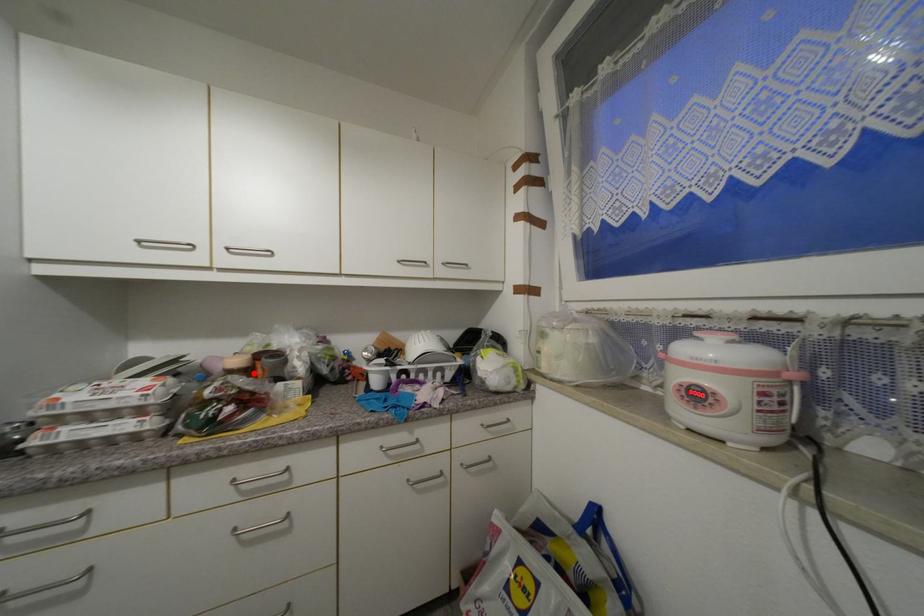
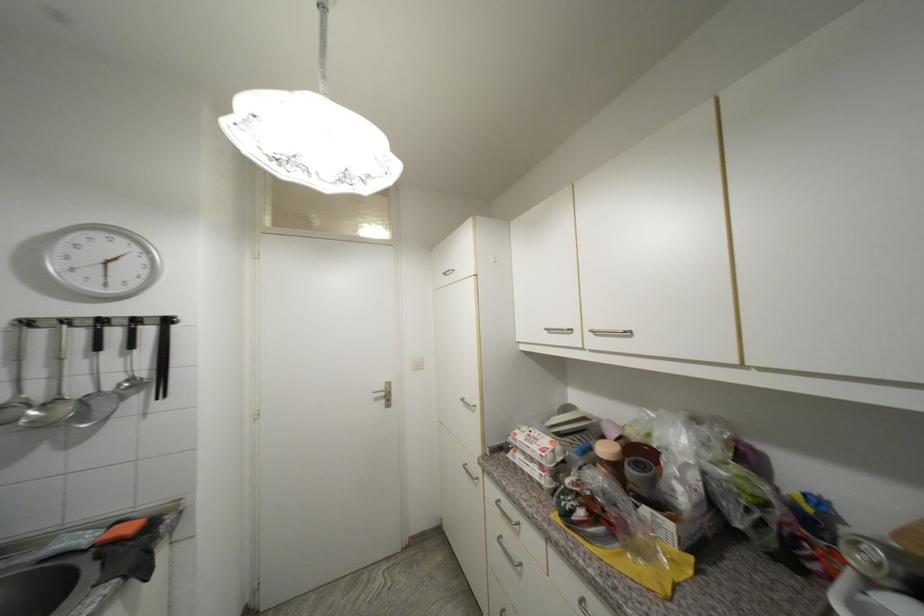
Find the pixel in the second image that matches the highlighted location in the first image.

(622, 469)